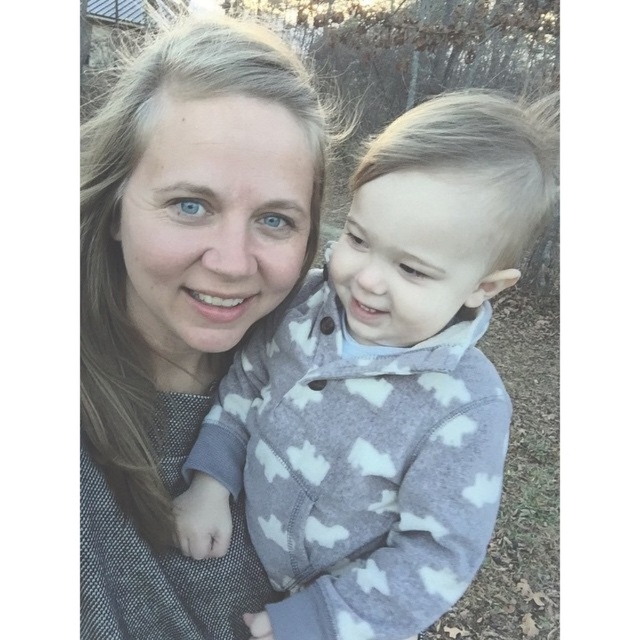
Question: Which of the following is the closest to the observer?

Choices:
 (A) (202, 552)
 (B) (148, 93)

Answer: (B)

Question: Is fuzzy gray sweater at center wider than matte gray sweater at center?

Choices:
 (A) yes
 (B) no

Answer: (A)

Question: Which point is closer to the camera taking this photo?

Choices:
 (A) (484, 436)
 (B) (253, 564)

Answer: (A)

Question: Which object appears farthest from the camera in this image?

Choices:
 (A) matte gray sweater at center
 (B) fuzzy gray sweater at center

Answer: (B)

Question: Can you confirm if fuzzy gray sweater at center is positioned to the left of matte gray sweater at center?

Choices:
 (A) no
 (B) yes

Answer: (A)

Question: Does fuzzy gray sweater at center appear on the right side of matte gray sweater at center?

Choices:
 (A) no
 (B) yes

Answer: (B)